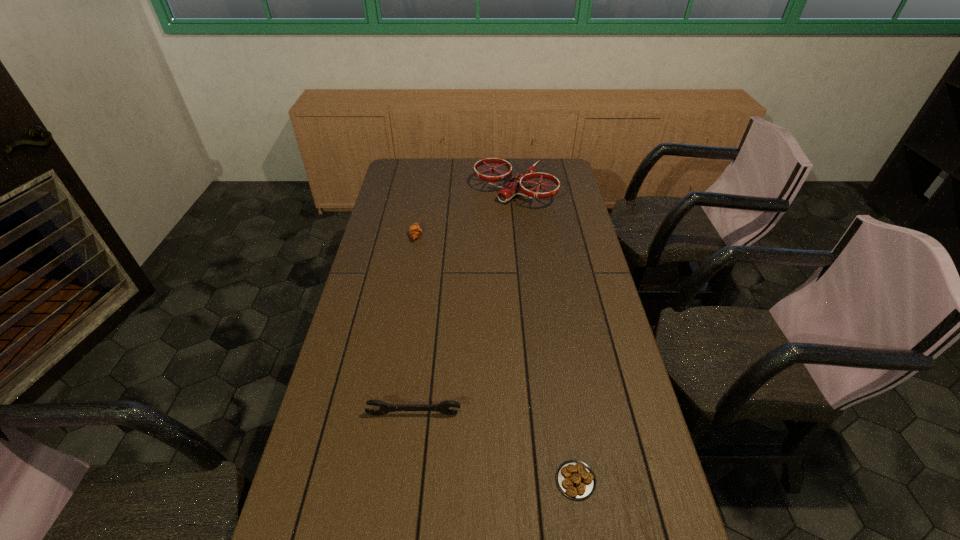
Find the location of a particular element. Image resolution: width=960 pixels, height=540 pixels. the farthest object is located at coordinates (514, 185).

Image resolution: width=960 pixels, height=540 pixels. Identify the location of drone. (514, 185).

Locate an element on the screen. This screenshot has height=540, width=960. the second nearest object is located at coordinates (443, 407).

You are a GUI agent. You are given a task and a screenshot of the screen. Output one action in this format:
    pyautogui.click(x=<x>, y=<y>)
    Task: Click on the third shortest object
    The height and width of the screenshot is (540, 960).
    Given the screenshot: What is the action you would take?
    pyautogui.click(x=443, y=407)

The height and width of the screenshot is (540, 960). I want to click on the taller pastry, so click(415, 231).

Locate an element on the screen. This screenshot has height=540, width=960. the farther pastry is located at coordinates (415, 231).

Find the location of `the shortest object`. the shortest object is located at coordinates (575, 479).

This screenshot has width=960, height=540. In order to click on the nearest object in this screenshot , I will do `click(575, 479)`.

This screenshot has height=540, width=960. I want to click on vacant space located on the left of the drone, so click(x=438, y=191).

The image size is (960, 540). I want to click on vacant region located on the open ends of the wrench, so click(407, 468).